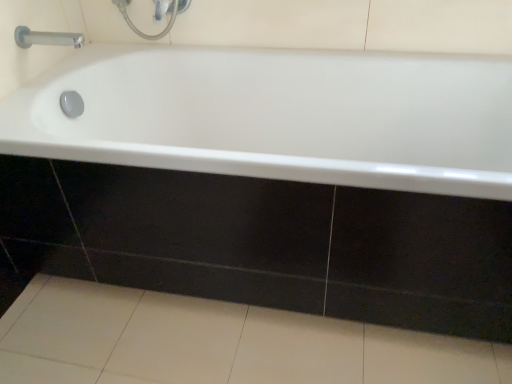
Identify the location of satin chrome faucet at upper left. The image size is (512, 384). (47, 38).

Image resolution: width=512 pixels, height=384 pixels. In order to click on white glossy bathtub at center in this screenshot , I will do [278, 116].

I want to click on bathtub located on the right of satin chrome faucet at upper left, so click(278, 116).

How far apart are satin chrome faucet at upper left and white glossy bathtub at center?

23.38 inches.

Between satin chrome faucet at upper left and white glossy bathtub at center, which one has larger size?

white glossy bathtub at center.

What's the angular difference between satin chrome faucet at upper left and white glossy bathtub at center's facing directions?

They differ by 89.3 degrees in their facing directions.

From the image's perspective, which one is positioned lower, satin chrome faucet at upper left or white glossy tile at lower center?

white glossy tile at lower center is shown below in the image.

Can you tell me how much satin chrome faucet at upper left and white glossy tile at lower center differ in facing direction?

satin chrome faucet at upper left and white glossy tile at lower center are facing 89.4 degrees away from each other.

Is satin chrome faucet at upper left completely or partially outside of white glossy tile at lower center?

satin chrome faucet at upper left lies outside white glossy tile at lower center's area.

Is white glossy tile at lower center aimed at satin chrome faucet at upper left?

No, white glossy tile at lower center is not facing towards satin chrome faucet at upper left.

Between white glossy tile at lower center and satin chrome faucet at upper left, which one has smaller size?

Smaller between the two is satin chrome faucet at upper left.

Is point (253, 355) closer or farther from the camera than point (23, 29)?

Point (253, 355) is positioned closer to the camera compared to point (23, 29).

Between point (470, 90) and point (47, 42), which one is positioned behind?

Point (470, 90)

Considering the positions of objects white glossy bathtub at center and satin chrome faucet at upper left in the image provided, who is more to the left, white glossy bathtub at center or satin chrome faucet at upper left?

From the viewer's perspective, satin chrome faucet at upper left appears more on the left side.

From the image's perspective, is white glossy bathtub at center above or below satin chrome faucet at upper left?

white glossy bathtub at center is situated lower than satin chrome faucet at upper left in the image.

Is white glossy tile at lower center positioned beyond the bounds of white glossy bathtub at center?

Absolutely, white glossy tile at lower center is external to white glossy bathtub at center.

Consider the image. From a real-world perspective, who is located lower, white glossy tile at lower center or white glossy bathtub at center?

white glossy tile at lower center, from a real-world perspective.

From the picture: Does white glossy tile at lower center have a larger size compared to white glossy bathtub at center?

No.

Is point (74, 351) positioned before point (490, 126)?

That is True.

Between white glossy bathtub at center and white glossy tile at lower center, which one has smaller size?

white glossy tile at lower center is smaller.

Would you say white glossy bathtub at center is a long distance from white glossy tile at lower center?

They are positioned close to each other.

Does white glossy bathtub at center have a greater width compared to white glossy tile at lower center?

Correct, the width of white glossy bathtub at center exceeds that of white glossy tile at lower center.

Between point (186, 151) and point (17, 331), which one is positioned in front?

Point (186, 151)

Locate an element on the screen. The height and width of the screenshot is (384, 512). bathtub that is in front of the satin chrome faucet at upper left is located at coordinates (278, 116).

In the image, there is a satin chrome faucet at upper left. Where is `ceramic tile below it (from a real-world perspective)`? ceramic tile below it (from a real-world perspective) is located at coordinates (217, 343).

From the image, which object appears to be nearer to white glossy bathtub at center, satin chrome faucet at upper left or white glossy tile at lower center?

Among the two, white glossy tile at lower center is located nearer to white glossy bathtub at center.

Looking at the image, which one is located closer to white glossy bathtub at center, white glossy tile at lower center or satin chrome faucet at upper left?

Based on the image, white glossy tile at lower center appears to be nearer to white glossy bathtub at center.

Looking at the image, which one is located closer to satin chrome faucet at upper left, white glossy bathtub at center or white glossy tile at lower center?

white glossy bathtub at center is closer to satin chrome faucet at upper left.

In the scene shown: Based on their spatial positions, is satin chrome faucet at upper left or white glossy bathtub at center further from white glossy tile at lower center?

satin chrome faucet at upper left.

Estimate the real-world distances between objects in this image. Which object is further from satin chrome faucet at upper left, white glossy tile at lower center or white glossy bathtub at center?

white glossy tile at lower center.

Estimate the real-world distances between objects in this image. Which object is closer to white glossy tile at lower center, white glossy bathtub at center or satin chrome faucet at upper left?

white glossy bathtub at center is closer to white glossy tile at lower center.

Where is `bathtub between satin chrome faucet at upper left and white glossy tile at lower center from top to bottom`? This screenshot has height=384, width=512. bathtub between satin chrome faucet at upper left and white glossy tile at lower center from top to bottom is located at coordinates (278, 116).